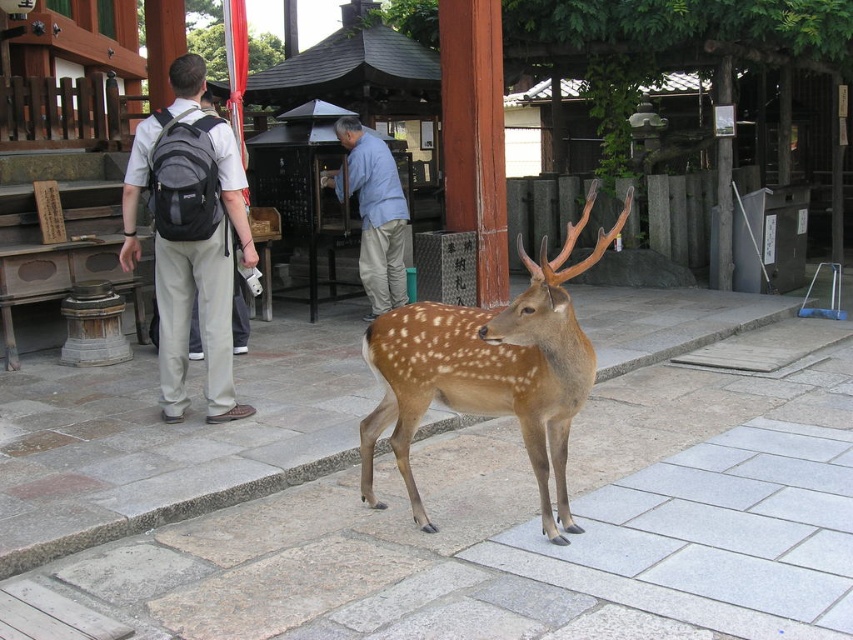
You are a photographer trying to capture a closeup of the deer while ensuring both the gray fabric backpack at upper left and the light blue cotton shirt at center are visible in the frame. Given their sizes, which object should you focus on to ensure both are in the shot without zooming in too much?

The gray fabric backpack at upper left is larger than the light blue cotton shirt at center, so focusing on the deer while keeping the backpack in the frame will naturally include the shirt as well due to its smaller size.

You are a photographer trying to capture a clear shot of the brown speckled fur at center and the light blue cotton shirt at center. Based on their positions, which object is blocking the view of the other?

The brown speckled fur at center is positioned under the light blue cotton shirt at center, so the light blue cotton shirt at center is blocking the view of the brown speckled fur at center.